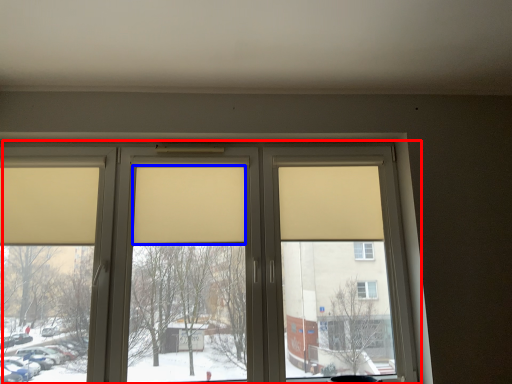
Question: Among these objects, which one is nearest to the camera, window (highlighted by a red box) or curtain (highlighted by a blue box)?

Choices:
 (A) window
 (B) curtain

Answer: (A)